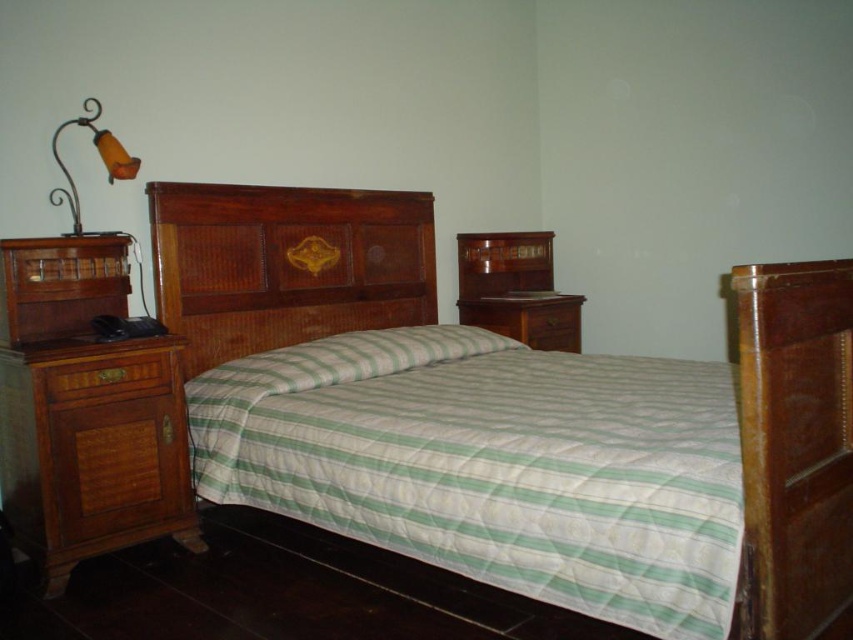
Question: Which of the following is the closest to the observer?

Choices:
 (A) (543, 336)
 (B) (473, 240)
 (C) (189, 289)
 (D) (173, 365)

Answer: (D)

Question: Is wooden bed at center thinner than brown wood drawer at center?

Choices:
 (A) no
 (B) yes

Answer: (A)

Question: Which point is closer to the camera taking this photo?

Choices:
 (A) (161, 497)
 (B) (51, 156)
 (C) (726, 381)
 (D) (492, 314)

Answer: (A)

Question: Does wooden bed at center have a larger size compared to wooden headboard at center?

Choices:
 (A) yes
 (B) no

Answer: (A)

Question: Does wooden drawer at left come behind brown wood drawer at center?

Choices:
 (A) no
 (B) yes

Answer: (A)

Question: Among these points, which one is nearest to the camera?

Choices:
 (A) (764, 602)
 (B) (245, 323)
 (C) (538, 244)
 (D) (86, 520)

Answer: (A)